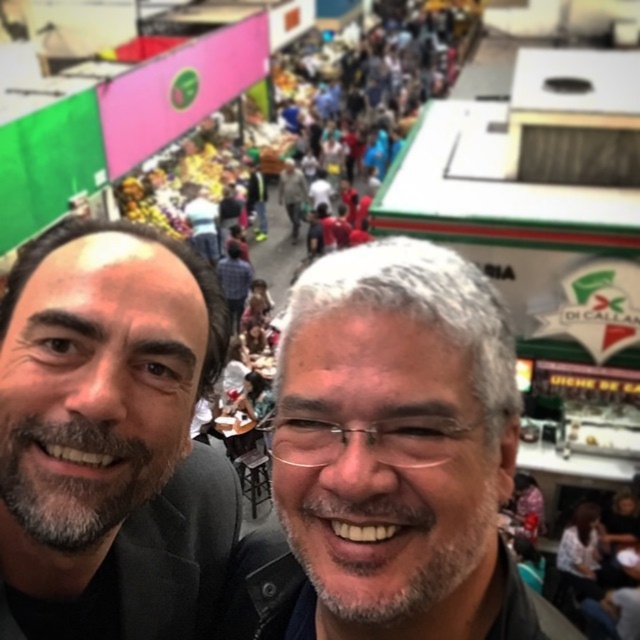
Question: Does gray hair at center appear on the right side of smooth black suit at left?

Choices:
 (A) no
 (B) yes

Answer: (B)

Question: Can you confirm if gray hair at center is thinner than smooth black suit at left?

Choices:
 (A) no
 (B) yes

Answer: (B)

Question: In this image, where is gray hair at center located relative to smooth black suit at left?

Choices:
 (A) above
 (B) below

Answer: (B)

Question: Which point appears closest to the camera in this image?

Choices:
 (A) (449, 387)
 (B) (198, 472)

Answer: (A)